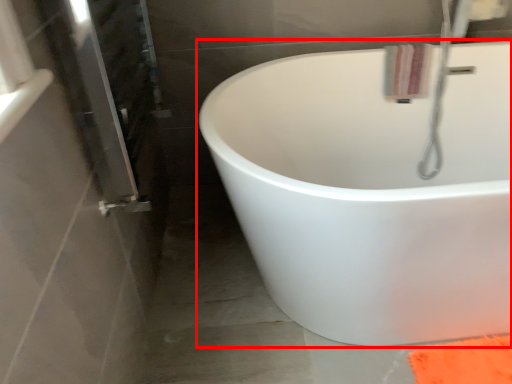
Question: Observing the image, what is the correct spatial positioning of bathtub (annotated by the red box) in reference to bath towel?

Choices:
 (A) right
 (B) left

Answer: (B)